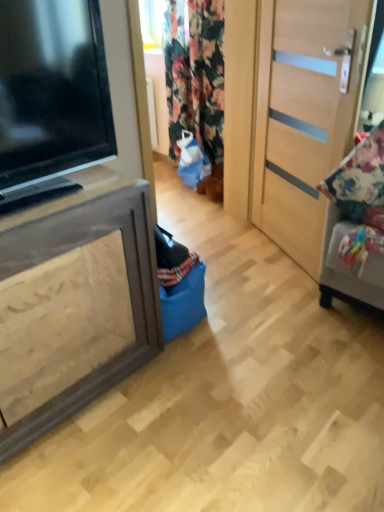
You are a GUI agent. You are given a task and a screenshot of the screen. Output one action in this format:
    pyautogui.click(x=<x>, y=<y>)
    Task: Click on the unoccupied region to the right of brown wood cabinet at left
    The width and height of the screenshot is (384, 512).
    Given the screenshot: What is the action you would take?
    pyautogui.click(x=204, y=393)